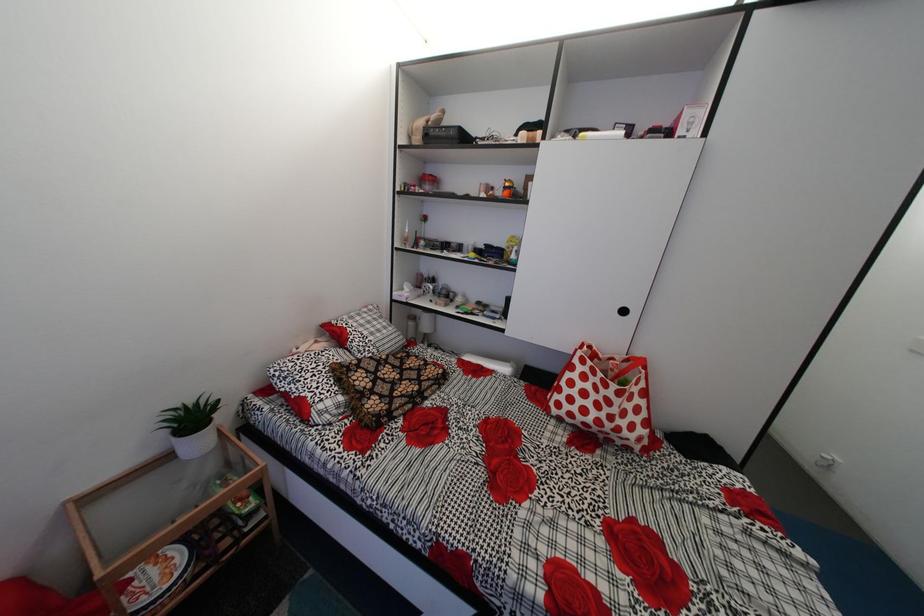
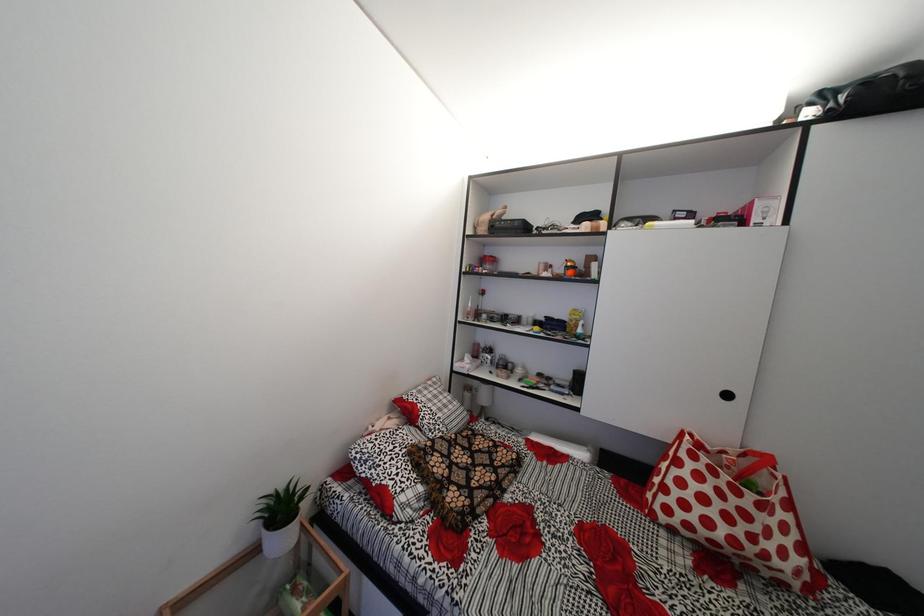
Question: How did the camera likely rotate?

Choices:
 (A) Left
 (B) Right
 (C) Up
 (D) Down

Answer: (C)